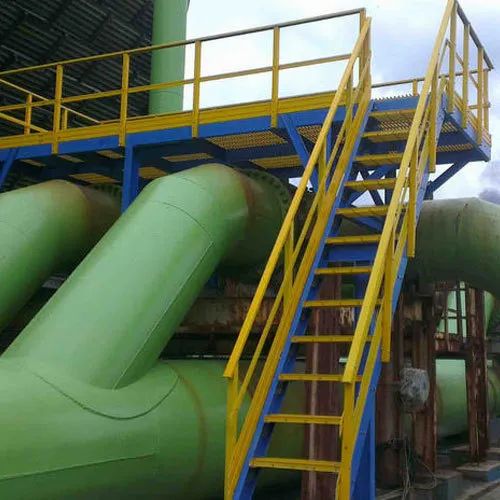
Identify the location of 1 right side of stair railing. This screenshot has width=500, height=500. (351, 462).